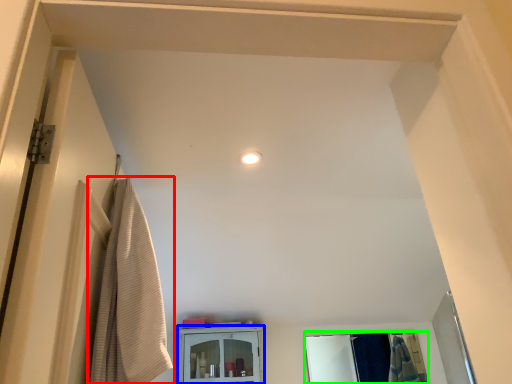
Question: Which object is positioned closest to curtain (highlighted by a red box)? Select from cabinetry (highlighted by a blue box) and mirror (highlighted by a green box).

Choices:
 (A) cabinetry
 (B) mirror

Answer: (A)